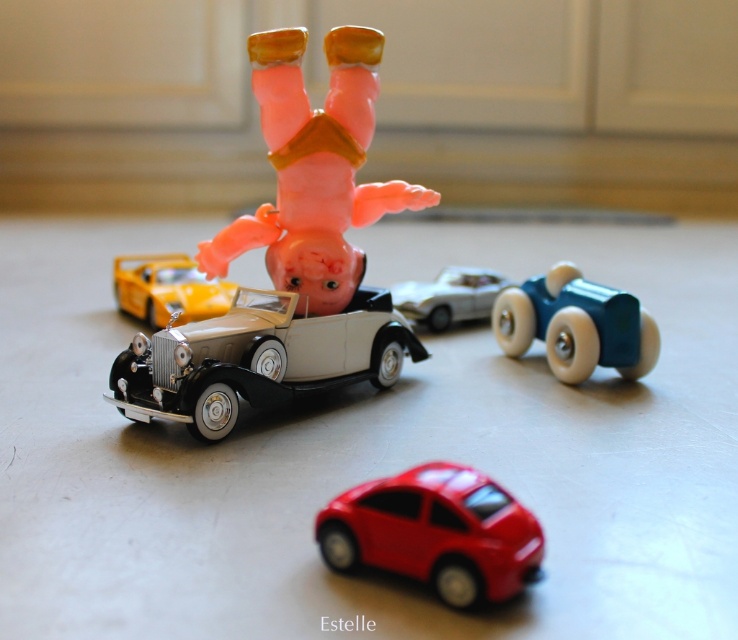
Question: Which object is the farthest from the shiny yellow car at center?

Choices:
 (A) shiny red car at center
 (B) black glossy vintage car at center

Answer: (A)

Question: Which point is closer to the camera taking this photo?

Choices:
 (A) (492, 563)
 (B) (393, 289)

Answer: (A)

Question: Is teal wooden toy car at right in front of shiny yellow car at center?

Choices:
 (A) yes
 (B) no

Answer: (A)

Question: Which point is farther from the camera taking this photo?

Choices:
 (A) (324, 104)
 (B) (441, 292)
 (C) (415, 496)
 (D) (131, 353)

Answer: (B)

Question: Is shiny red car at center wider than teal wooden toy car at right?

Choices:
 (A) yes
 (B) no

Answer: (B)

Question: Observing the image, what is the correct spatial positioning of shiny red car at center in reference to shiny yellow car at center?

Choices:
 (A) below
 (B) above

Answer: (A)